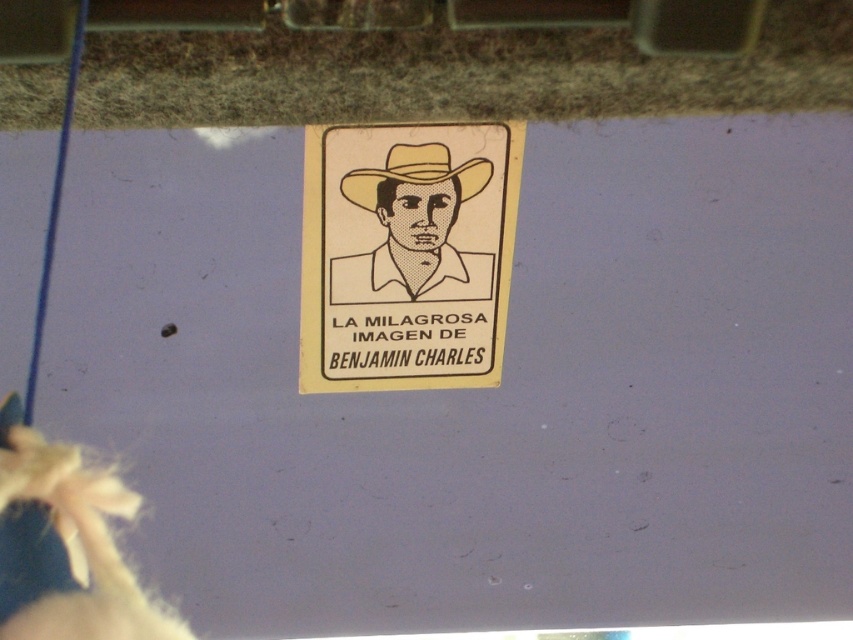
You are trying to read the text on the white paper sign at center and the beige paper cowboy hat at center. Which one is closer to you?

The white paper sign at center is in front of the beige paper cowboy hat at center, so the white paper sign at center is closer to you.

You are an interior designer analyzing the placement of objects in a room. You notice a point at coordinates (413,230). Based on the scene description, what object is located at this point?

The point at coordinates (413,230) corresponds to the beige paper sticker at center.

You are a delivery person who needs to read the text on the white paper sign at center and the beige paper sticker at center. Which one is located lower in the image?

The white paper sign at center is positioned under the beige paper sticker at center, so the white paper sign at center is located lower in the image.